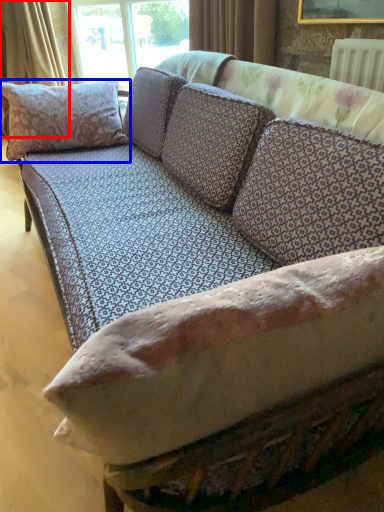
Question: Which point is further to the camera, curtain (highlighted by a red box) or pillow (highlighted by a blue box)?

Choices:
 (A) curtain
 (B) pillow

Answer: (A)